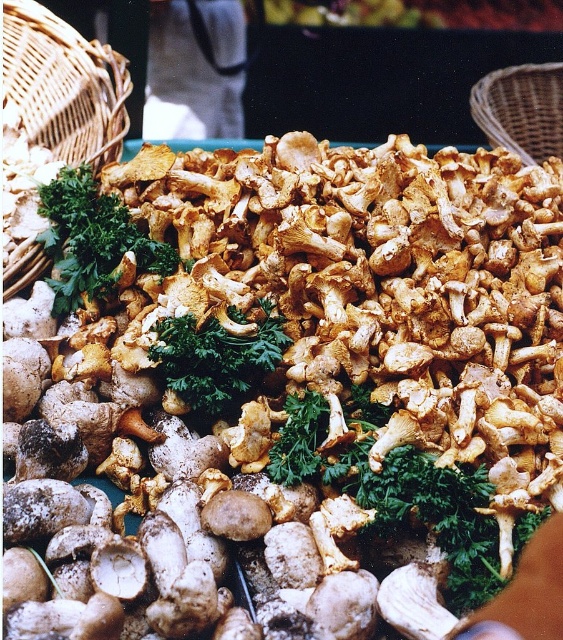
Which is above, green leafy at center or woven brown basket at upper right?

woven brown basket at upper right is above.

The width and height of the screenshot is (563, 640). Describe the element at coordinates (217, 356) in the screenshot. I see `green leafy at center` at that location.

The height and width of the screenshot is (640, 563). In order to click on green leafy at center in this screenshot , I will do `click(217, 356)`.

Is the position of woven brown basket at upper left more distant than that of woven brown basket at upper right?

No, it is not.

Does point (82, 81) come farther from viewer compared to point (490, 134)?

No, it is in front of (490, 134).

Does point (87, 92) come in front of point (551, 125)?

Yes, point (87, 92) is closer to viewer.

I want to click on woven brown basket at upper left, so click(x=64, y=84).

Is woven brown basket at upper left smaller than green leafy at center?

No.

Is point (69, 58) positioned after point (186, 314)?

Yes, it is.

Locate an element on the screen. woven brown basket at upper left is located at coordinates (64, 84).